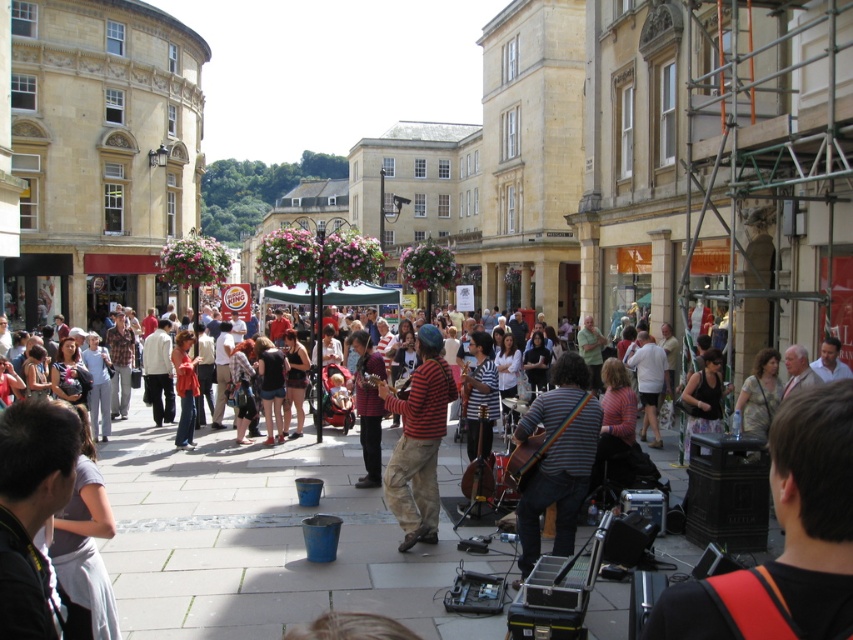
You are a photographer standing at the edge of the square. You want to capture both the striped fabric guitar at center and the striped cotton shirt at center in a single photo. Which object should you focus on first to ensure both are in frame?

The striped fabric guitar at center is taller than the striped cotton shirt at center, so focus on the guitar first to ensure its full height is captured, then adjust the frame to include the shirt.

You are a photographer standing at the edge of the square. You want to take a photo that includes both the striped fabric guitar at center and the striped cotton shirt at center. Given that your camera has a maximum focus range of 8 meters, will you be able to capture both objects in focus without moving your position?

The distance between the striped fabric guitar at center and the striped cotton shirt at center is 8.58 meters. Since the camera can only focus up to 8 meters, capturing both objects in focus without moving is not possible.